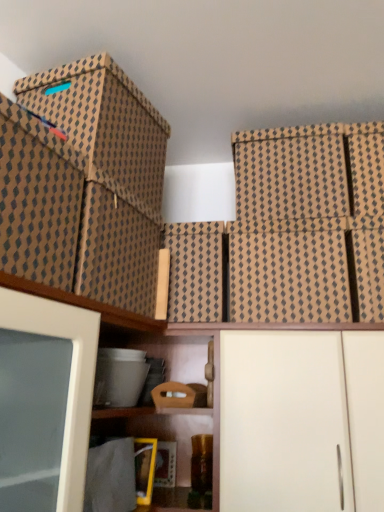
At what (x,y) coordinates should I click in order to perform the action: click on brown patterned box at upper left, which is the ninth storage box from right to left. Please return your answer as a coordinate pair (x, y). Image resolution: width=384 pixels, height=512 pixels. Looking at the image, I should click on (38, 199).

Describe the element at coordinates (301, 420) in the screenshot. This screenshot has height=512, width=384. I see `white matte cabinet at lower center` at that location.

How much space does brown cardboard box at center, which is the fifth storage box from right to left, occupy vertically?

brown cardboard box at center, which is the fifth storage box from right to left, is 13.44 inches in height.

Locate an element on the screen. The image size is (384, 512). brown textured box at upper right, the seventh storage box viewed from the left is located at coordinates (290, 173).

Considering the sizes of objects brown textured box at upper right, placed as the 9th storage box when sorted from left to right, and brown textured box at center, positioned as the fourth storage box in right-to-left order, in the image provided, who is taller, brown textured box at upper right, placed as the 9th storage box when sorted from left to right, or brown textured box at center, positioned as the fourth storage box in right-to-left order,?

brown textured box at upper right, placed as the 9th storage box when sorted from left to right.

Where is `storage box that is the 4th one when counting downward from the brown textured box at upper right, acting as the 1th storage box starting from the right (from the image's perspective)`? The width and height of the screenshot is (384, 512). storage box that is the 4th one when counting downward from the brown textured box at upper right, acting as the 1th storage box starting from the right (from the image's perspective) is located at coordinates (289, 277).

Is brown textured box at center, positioned as the fourth storage box in right-to-left order, a part of brown textured box at upper right, acting as the 1th storage box starting from the right?

No, brown textured box at center, positioned as the fourth storage box in right-to-left order, is not inside brown textured box at upper right, acting as the 1th storage box starting from the right.

Does point (356, 143) appear closer or farther from the camera than point (320, 313)?

Clearly, point (356, 143) is more distant from the camera than point (320, 313).

Considering the positions of objects wooden box at center, the sixth storage box positioned from the right, and white matte cabinet at lower center in the image provided, who is behind, wooden box at center, the sixth storage box positioned from the right, or white matte cabinet at lower center?

wooden box at center, the sixth storage box positioned from the right, is further away from the camera.

Is wooden box at center, which is the fourth storage box in left-to-right order, directly adjacent to white matte cabinet at lower center?

No, wooden box at center, which is the fourth storage box in left-to-right order, is not touching white matte cabinet at lower center.

From the image's perspective, is wooden box at center, which is the fourth storage box in left-to-right order, below white matte cabinet at lower center?

Actually, wooden box at center, which is the fourth storage box in left-to-right order, appears above white matte cabinet at lower center in the image.

Which of these two, wooden box at center, which is the fourth storage box in left-to-right order, or white matte cabinet at lower center, stands taller?

white matte cabinet at lower center is taller.

Is white matte cabinet at lower center situated inside brown patterned box at upper left, positioned as the 1th storage box in left-to-right order, or outside?

white matte cabinet at lower center lies outside brown patterned box at upper left, positioned as the 1th storage box in left-to-right order.

Is point (338, 419) less distant than point (36, 138)?

That is False.

Which of these two, white matte cabinet at lower center or brown patterned box at upper left, which is the ninth storage box from right to left, is wider?

white matte cabinet at lower center.

From the image's perspective, is white matte cabinet at lower center positioned above or below brown patterned box at upper left, positioned as the 1th storage box in left-to-right order?

Clearly, from the image's perspective, white matte cabinet at lower center is below brown patterned box at upper left, positioned as the 1th storage box in left-to-right order.

Considering the relative sizes of brown textured box at upper right, the third storage box viewed from the right, and brown cardboard box at upper left, acting as the 2th storage box starting from the left, in the image provided, is brown textured box at upper right, the third storage box viewed from the right, smaller than brown cardboard box at upper left, acting as the 2th storage box starting from the left,?

Correct, brown textured box at upper right, the third storage box viewed from the right, occupies less space than brown cardboard box at upper left, acting as the 2th storage box starting from the left.

Considering the sizes of brown textured box at upper right, the third storage box viewed from the right, and brown cardboard box at upper left, the 8th storage box when ordered from right to left, in the image, is brown textured box at upper right, the third storage box viewed from the right, wider or thinner than brown cardboard box at upper left, the 8th storage box when ordered from right to left,?

brown textured box at upper right, the third storage box viewed from the right, is thinner than brown cardboard box at upper left, the 8th storage box when ordered from right to left.

From a real-world perspective, starting from the brown cardboard box at upper left, the 8th storage box when ordered from right to left, which storage box is the 2nd one below it? Please provide its 2D coordinates.

[(290, 173)]

Considering the sizes of objects brown textured box at center, which ranks as the sixth storage box in left-to-right order, and brown cardboard box at upper right, which ranks as the second storage box in right-to-left order, in the image provided, who is shorter, brown textured box at center, which ranks as the sixth storage box in left-to-right order, or brown cardboard box at upper right, which ranks as the second storage box in right-to-left order,?

Standing shorter between the two is brown textured box at center, which ranks as the sixth storage box in left-to-right order.

Can you confirm if brown textured box at center, positioned as the fourth storage box in right-to-left order, is smaller than brown cardboard box at upper right, which ranks as the second storage box in right-to-left order?

No.

Is brown textured box at center, positioned as the fourth storage box in right-to-left order, positioned with its back to brown cardboard box at upper right, which ranks as the 8th storage box in left-to-right order?

No, brown cardboard box at upper right, which ranks as the 8th storage box in left-to-right order, is not at the back of brown textured box at center, positioned as the fourth storage box in right-to-left order.

Is brown textured box at center, which ranks as the sixth storage box in left-to-right order, not close to brown cardboard box at upper right, which ranks as the second storage box in right-to-left order?

No.

Does brown cardboard box at upper right, which ranks as the second storage box in right-to-left order, have a greater height compared to brown cardboard box at center, which is the fifth storage box from right to left?

No.

Do you think brown cardboard box at upper right, which ranks as the 8th storage box in left-to-right order, is within brown cardboard box at center, the fifth storage box positioned from the left, or outside of it?

brown cardboard box at upper right, which ranks as the 8th storage box in left-to-right order, is not inside brown cardboard box at center, the fifth storage box positioned from the left, it's outside.

Considering the relative sizes of brown cardboard box at upper right, which ranks as the 8th storage box in left-to-right order, and brown cardboard box at center, the fifth storage box positioned from the left, in the image provided, is brown cardboard box at upper right, which ranks as the 8th storage box in left-to-right order, smaller than brown cardboard box at center, the fifth storage box positioned from the left,?

Yes, brown cardboard box at upper right, which ranks as the 8th storage box in left-to-right order, is smaller than brown cardboard box at center, the fifth storage box positioned from the left.

What's the angular difference between brown cardboard box at upper right, which ranks as the second storage box in right-to-left order, and brown cardboard box at center, which is the fifth storage box from right to left,'s facing directions?

They differ by 0.000561 degrees in their facing directions.

Does point (102, 155) appear closer or farther from the camera than point (319, 358)?

Point (102, 155).

Is brown cardboard box at upper left, acting as the 2th storage box starting from the left, facing away from white matte cabinet at lower center?

No, white matte cabinet at lower center is not at the back of brown cardboard box at upper left, acting as the 2th storage box starting from the left.

Is there a large distance between brown cardboard box at upper left, the 8th storage box when ordered from right to left, and white matte cabinet at lower center?

No, there isn't a large distance between brown cardboard box at upper left, the 8th storage box when ordered from right to left, and white matte cabinet at lower center.

This screenshot has width=384, height=512. Identify the location of storage box that is the 3rd object to the left of the brown textured box at upper right, placed as the 9th storage box when sorted from left to right, starting at the anchor. (289, 277).

Where is `cabinetry on the right of wooden box at center, which is the fourth storage box in left-to-right order`? cabinetry on the right of wooden box at center, which is the fourth storage box in left-to-right order is located at coordinates (301, 420).

Consider the image. When comparing their distances from white matte plastic storage box at lower center, which ranks as the 7th storage box in right-to-left order, does brown textured box at center, which ranks as the sixth storage box in left-to-right order, or white matte cabinet at lower center seem closer?

white matte cabinet at lower center is positioned closer to the anchor white matte plastic storage box at lower center, which ranks as the 7th storage box in right-to-left order.

Based on their spatial positions, is brown textured box at center, which ranks as the sixth storage box in left-to-right order, or brown cardboard box at upper right, which ranks as the 8th storage box in left-to-right order, further from brown cardboard box at upper left, acting as the 2th storage box starting from the left?

The object further to brown cardboard box at upper left, acting as the 2th storage box starting from the left, is brown cardboard box at upper right, which ranks as the 8th storage box in left-to-right order.

From the image, which object appears to be farther from brown cardboard box at upper right, which ranks as the second storage box in right-to-left order, brown textured box at upper right, placed as the 9th storage box when sorted from left to right, or white matte cabinet at lower center?

The object further to brown cardboard box at upper right, which ranks as the second storage box in right-to-left order, is white matte cabinet at lower center.

Which object lies nearer to the anchor point brown textured box at upper right, the seventh storage box viewed from the left, white matte plastic storage box at lower center, which ranks as the 7th storage box in right-to-left order, or brown cardboard box at center, the fifth storage box positioned from the left?

The object closer to brown textured box at upper right, the seventh storage box viewed from the left, is brown cardboard box at center, the fifth storage box positioned from the left.

Which object lies nearer to the anchor point white matte plastic storage box at lower center, positioned as the third storage box in left-to-right order, wooden box at center, which is the fourth storage box in left-to-right order, or brown cardboard box at center, the fifth storage box positioned from the left?

wooden box at center, which is the fourth storage box in left-to-right order.

Looking at the image, which one is located further to white matte cabinet at lower center, brown textured box at upper right, the seventh storage box viewed from the left, or white matte plastic storage box at lower center, which ranks as the 7th storage box in right-to-left order?

brown textured box at upper right, the seventh storage box viewed from the left.

When comparing their distances from brown cardboard box at upper left, acting as the 2th storage box starting from the left, does brown textured box at center, positioned as the fourth storage box in right-to-left order, or brown cardboard box at center, which is the fifth storage box from right to left, seem closer?

brown cardboard box at center, which is the fifth storage box from right to left, is positioned closer to the anchor brown cardboard box at upper left, acting as the 2th storage box starting from the left.

Estimate the real-world distances between objects in this image. Which object is closer to brown textured box at center, positioned as the fourth storage box in right-to-left order, wooden box at center, the sixth storage box positioned from the right, or white matte cabinet at lower center?

Among the two, white matte cabinet at lower center is located nearer to brown textured box at center, positioned as the fourth storage box in right-to-left order.

The height and width of the screenshot is (512, 384). I want to click on cabinetry between brown cardboard box at upper left, the 8th storage box when ordered from right to left, and brown cardboard box at upper right, which ranks as the second storage box in right-to-left order, in the horizontal direction, so click(301, 420).

Locate an element on the screen. Image resolution: width=384 pixels, height=512 pixels. cabinetry between white matte plastic storage box at lower center, which ranks as the 7th storage box in right-to-left order, and brown textured box at center, positioned as the fourth storage box in right-to-left order, from left to right is located at coordinates (301, 420).

Locate an element on the screen. Image resolution: width=384 pixels, height=512 pixels. storage box situated between wooden box at center, which is the fourth storage box in left-to-right order, and brown textured box at center, positioned as the fourth storage box in right-to-left order, from left to right is located at coordinates click(195, 271).

Where is `cabinetry situated between wooden box at center, the sixth storage box positioned from the right, and brown cardboard box at upper right, which ranks as the second storage box in right-to-left order, from left to right`? The height and width of the screenshot is (512, 384). cabinetry situated between wooden box at center, the sixth storage box positioned from the right, and brown cardboard box at upper right, which ranks as the second storage box in right-to-left order, from left to right is located at coordinates (301, 420).